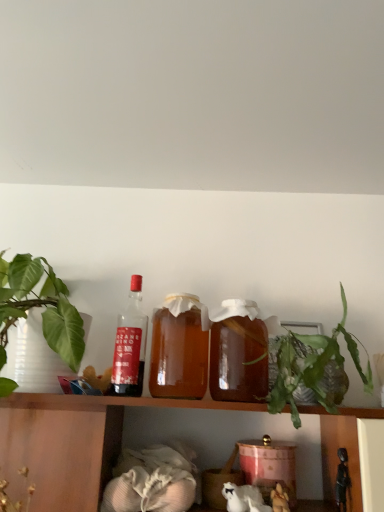
Identify the location of fluffy white stuffed animal at lower center, the first toy when ordered from left to right. The height and width of the screenshot is (512, 384). (279, 499).

This screenshot has height=512, width=384. What do you see at coordinates (342, 480) in the screenshot?
I see `shiny black figurine at lower right, which is the first toy from right to left` at bounding box center [342, 480].

Identify the location of matte glass bottle at left, the 3th bottle in the right-to-left sequence. (130, 345).

What is the approximate width of translucent glass bottle at center, acting as the 2th bottle starting from the left?

6.15 inches.

The width and height of the screenshot is (384, 512). What do you see at coordinates (238, 352) in the screenshot?
I see `translucent glass bottle at center, the 1th bottle positioned from the right` at bounding box center [238, 352].

Where is `fluffy white stuffed animal at lower center, acting as the 2th toy starting from the right`? This screenshot has height=512, width=384. fluffy white stuffed animal at lower center, acting as the 2th toy starting from the right is located at coordinates (279, 499).

The width and height of the screenshot is (384, 512). I want to click on toy located underneath the shiny black figurine at lower right, arranged as the 2th toy when viewed from the left (from a real-world perspective), so click(x=279, y=499).

Which object is thinner, shiny black figurine at lower right, arranged as the 2th toy when viewed from the left, or fluffy white stuffed animal at lower center, the first toy when ordered from left to right?

Thinner between the two is shiny black figurine at lower right, arranged as the 2th toy when viewed from the left.

Based on the photo, which object is further away from the camera, shiny black figurine at lower right, arranged as the 2th toy when viewed from the left, or fluffy white stuffed animal at lower center, the first toy when ordered from left to right?

fluffy white stuffed animal at lower center, the first toy when ordered from left to right, is more distant.

Considering the points (273, 500) and (358, 362), which point is in front, point (273, 500) or point (358, 362)?

The point (273, 500) is closer.

From the image's perspective, between fluffy white stuffed animal at lower center, the first toy when ordered from left to right, and green leafy plant at right, which one is located above?

green leafy plant at right.

Is fluffy white stuffed animal at lower center, acting as the 2th toy starting from the right, inside or outside of green leafy plant at right?

fluffy white stuffed animal at lower center, acting as the 2th toy starting from the right, is not enclosed by green leafy plant at right.

Find the location of a particular element. This screenshot has width=384, height=512. houseplant located above the fluffy white stuffed animal at lower center, the first toy when ordered from left to right (from a real-world perspective) is located at coordinates (312, 366).

Based on their sizes in the image, would you say translucent glass bottle at center, positioned as the 3th bottle in left-to-right order, is bigger or smaller than white fur cat at lower center?

Clearly, translucent glass bottle at center, positioned as the 3th bottle in left-to-right order, is larger in size than white fur cat at lower center.

Which is less distant, (227,385) or (222,490)?

Point (227,385).

Is translucent glass bottle at center, positioned as the 3th bottle in left-to-right order, positioned with its back to white fur cat at lower center?

No, translucent glass bottle at center, positioned as the 3th bottle in left-to-right order, is not facing away from white fur cat at lower center.

Can we say translucent glass bottle at center, positioned as the 3th bottle in left-to-right order, lies outside white fur cat at lower center?

Yes, translucent glass bottle at center, positioned as the 3th bottle in left-to-right order, is outside of white fur cat at lower center.

Can you confirm if translucent glass bottle at center, acting as the 2th bottle starting from the left, is wider than white fur cat at lower center?

Indeed, translucent glass bottle at center, acting as the 2th bottle starting from the left, has a greater width compared to white fur cat at lower center.

From a real-world perspective, relative to white fur cat at lower center, is translucent glass bottle at center, which is counted as the 2th bottle, starting from the right, vertically above or below?

translucent glass bottle at center, which is counted as the 2th bottle, starting from the right, is situated higher than white fur cat at lower center in the real world.

Is point (162, 383) in front of point (231, 498)?

No, it is not.

Who is bigger, translucent glass bottle at center, which is counted as the 2th bottle, starting from the right, or white fur cat at lower center?

translucent glass bottle at center, which is counted as the 2th bottle, starting from the right, is bigger.

Between fluffy white stuffed animal at lower center, the first toy when ordered from left to right, and shiny black figurine at lower right, which is the first toy from right to left, which one has more height?

shiny black figurine at lower right, which is the first toy from right to left, is taller.

Is fluffy white stuffed animal at lower center, the first toy when ordered from left to right, completely or partially outside of shiny black figurine at lower right, which is the first toy from right to left?

Yes, fluffy white stuffed animal at lower center, the first toy when ordered from left to right, is located beyond the bounds of shiny black figurine at lower right, which is the first toy from right to left.

This screenshot has width=384, height=512. What are the coordinates of `toy above the fluffy white stuffed animal at lower center, the first toy when ordered from left to right (from the image's perspective)` in the screenshot? It's located at (342, 480).

Which of these two, fluffy white stuffed animal at lower center, the first toy when ordered from left to right, or shiny black figurine at lower right, which is the first toy from right to left, is bigger?

A: shiny black figurine at lower right, which is the first toy from right to left, is bigger.

Looking at this image, can you see green leafy plant at right touching matte glass bottle at left, marked as the 1th bottle in a left-to-right arrangement?

No.

Considering the points (368, 381) and (147, 328), which point is in front, point (368, 381) or point (147, 328)?

The point (147, 328) is in front.

Is green leafy plant at right to the left of matte glass bottle at left, marked as the 1th bottle in a left-to-right arrangement, from the viewer's perspective?

In fact, green leafy plant at right is to the right of matte glass bottle at left, marked as the 1th bottle in a left-to-right arrangement.

Who is bigger, green leafy plant at right or matte glass bottle at left, marked as the 1th bottle in a left-to-right arrangement?

green leafy plant at right.

From the image's perspective, who appears lower, white fur cat at lower center or fluffy white stuffed animal at lower center, acting as the 2th toy starting from the right?

fluffy white stuffed animal at lower center, acting as the 2th toy starting from the right, is shown below in the image.

Between white fur cat at lower center and fluffy white stuffed animal at lower center, acting as the 2th toy starting from the right, which one has less height?

fluffy white stuffed animal at lower center, acting as the 2th toy starting from the right, is shorter.

Looking at this image, is white fur cat at lower center looking in the opposite direction of fluffy white stuffed animal at lower center, acting as the 2th toy starting from the right?

white fur cat at lower center is not turned away from fluffy white stuffed animal at lower center, acting as the 2th toy starting from the right.

Considering the relative sizes of white fur cat at lower center and fluffy white stuffed animal at lower center, the first toy when ordered from left to right, in the image provided, is white fur cat at lower center thinner than fluffy white stuffed animal at lower center, the first toy when ordered from left to right,?

No.

Find the location of a particular element. This screenshot has width=384, height=512. toy behind the shiny black figurine at lower right, which is the first toy from right to left is located at coordinates (279, 499).

Locate an element on the screen. Image resolution: width=384 pixels, height=512 pixels. houseplant above the fluffy white stuffed animal at lower center, acting as the 2th toy starting from the right (from a real-world perspective) is located at coordinates (312, 366).

Which object lies nearer to the anchor point green leafy plant at right, translucent glass bottle at center, which is counted as the 2th bottle, starting from the right, or translucent glass bottle at center, the 1th bottle positioned from the right?

translucent glass bottle at center, the 1th bottle positioned from the right, is positioned closer to the anchor green leafy plant at right.

Based on their spatial positions, is fluffy white stuffed animal at lower center, acting as the 2th toy starting from the right, or matte glass bottle at left, marked as the 1th bottle in a left-to-right arrangement, closer to green leafy plant at right?

fluffy white stuffed animal at lower center, acting as the 2th toy starting from the right, lies closer to green leafy plant at right than the other object.

Considering their positions, is shiny black figurine at lower right, arranged as the 2th toy when viewed from the left, positioned further to fluffy white stuffed animal at lower center, the first toy when ordered from left to right, than matte glass bottle at left, marked as the 1th bottle in a left-to-right arrangement?

Based on the image, matte glass bottle at left, marked as the 1th bottle in a left-to-right arrangement, appears to be further to fluffy white stuffed animal at lower center, the first toy when ordered from left to right.

When comparing their distances from shiny black figurine at lower right, which is the first toy from right to left, does translucent glass bottle at center, acting as the 2th bottle starting from the left, or matte glass bottle at left, the 3th bottle in the right-to-left sequence, seem closer?

translucent glass bottle at center, acting as the 2th bottle starting from the left.

When comparing their distances from shiny black figurine at lower right, which is the first toy from right to left, does translucent glass bottle at center, which is counted as the 2th bottle, starting from the right, or white fur cat at lower center seem further?

translucent glass bottle at center, which is counted as the 2th bottle, starting from the right.

Considering their positions, is matte glass bottle at left, marked as the 1th bottle in a left-to-right arrangement, positioned further to fluffy white stuffed animal at lower center, the first toy when ordered from left to right, than shiny black figurine at lower right, arranged as the 2th toy when viewed from the left?

matte glass bottle at left, marked as the 1th bottle in a left-to-right arrangement, is further to fluffy white stuffed animal at lower center, the first toy when ordered from left to right.

Considering their positions, is fluffy white stuffed animal at lower center, the first toy when ordered from left to right, positioned further to matte glass bottle at left, marked as the 1th bottle in a left-to-right arrangement, than shiny black figurine at lower right, arranged as the 2th toy when viewed from the left?

shiny black figurine at lower right, arranged as the 2th toy when viewed from the left.

Looking at the image, which one is located further to matte glass bottle at left, marked as the 1th bottle in a left-to-right arrangement, green leafy plant at right or translucent glass bottle at center, the 1th bottle positioned from the right?

Among the two, green leafy plant at right is located further to matte glass bottle at left, marked as the 1th bottle in a left-to-right arrangement.

Locate an element on the screen. This screenshot has width=384, height=512. houseplant that lies between translucent glass bottle at center, the 1th bottle positioned from the right, and shiny black figurine at lower right, arranged as the 2th toy when viewed from the left, from top to bottom is located at coordinates (312, 366).

Identify the location of houseplant between translucent glass bottle at center, the 1th bottle positioned from the right, and white fur cat at lower center, in the vertical direction. This screenshot has width=384, height=512. (312, 366).

At what (x,y) coordinates should I click in order to perform the action: click on toy between translucent glass bottle at center, which is counted as the 2th bottle, starting from the right, and fluffy white stuffed animal at lower center, acting as the 2th toy starting from the right, in the vertical direction. Please return your answer as a coordinate pair (x, y). This screenshot has height=512, width=384. Looking at the image, I should click on point(342,480).

Locate an element on the screen. animal between matte glass bottle at left, marked as the 1th bottle in a left-to-right arrangement, and shiny black figurine at lower right, arranged as the 2th toy when viewed from the left is located at coordinates (244, 498).